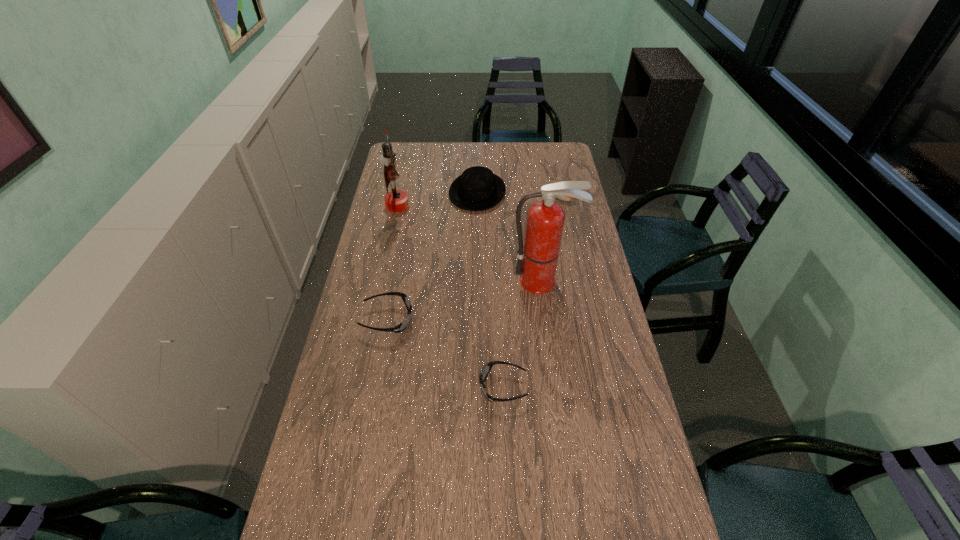
You are a GUI agent. You are given a task and a screenshot of the screen. Output one action in this format:
    pyautogui.click(x=<x>, y=<y>)
    Task: Click on the unoccupied position between the taller sunglasses and the right sunglasses
    The height and width of the screenshot is (540, 960).
    Given the screenshot: What is the action you would take?
    pyautogui.click(x=445, y=353)

The image size is (960, 540). I want to click on object that is the fourth nearest to the taller sunglasses, so click(x=477, y=188).

Locate which object ranks second in proximity to the nearer sunglasses. Please provide its 2D coordinates. Your answer should be formatted as a tuple, i.e. [(x, y)], where the tuple contains the x and y coordinates of a point satisfying the conditions above.

[(537, 261)]

Image resolution: width=960 pixels, height=540 pixels. Identify the location of vacant space that satisfies the following two spatial constraints: 1. with the handle and hose on the third nearest object; 2. on the lenses of the nearest object. (557, 387).

At what (x,y) coordinates should I click in order to perform the action: click on free location that satisfies the following two spatial constraints: 1. with the handle and hose on the fire extinguisher; 2. on the lenses of the taller sunglasses. Please return your answer as a coordinate pair (x, y). Looking at the image, I should click on click(x=547, y=319).